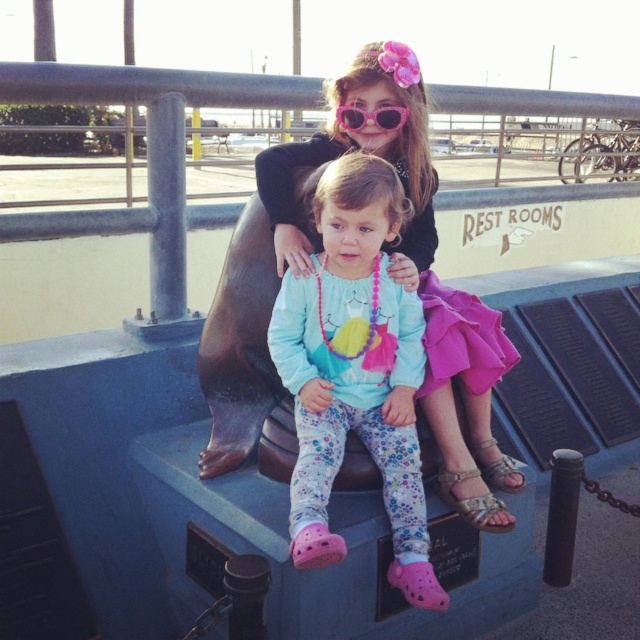
Who is shorter, matte black dress at center or pink plastic sunglasses at upper center?

Standing shorter between the two is pink plastic sunglasses at upper center.

In the scene shown: Is matte black dress at center above pink plastic sunglasses at upper center?

Actually, matte black dress at center is below pink plastic sunglasses at upper center.

The image size is (640, 640). In order to click on matte black dress at center in this screenshot , I will do `click(412, 273)`.

In the scene shown: Can you confirm if fluffy cotton pants at center is wider than pink plastic sunglasses at upper center?

Yes.

Does point (417, 372) come in front of point (353, 108)?

Yes, it is.

Is point (285, 320) closer to camera compared to point (346, 116)?

Yes.

The height and width of the screenshot is (640, 640). Identify the location of fluffy cotton pants at center. (355, 371).

Is point (305, 394) positioned after point (480, 486)?

No, (305, 394) is closer to viewer.

Where is `fluffy cotton pants at center`? The image size is (640, 640). fluffy cotton pants at center is located at coordinates (355, 371).